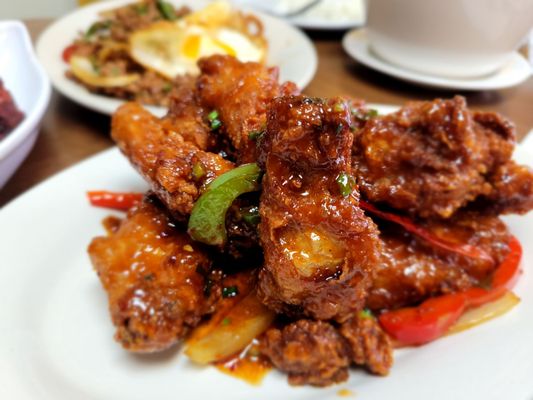
What are the coordinates of `table` in the screenshot? It's located at (341, 75), (60, 135).